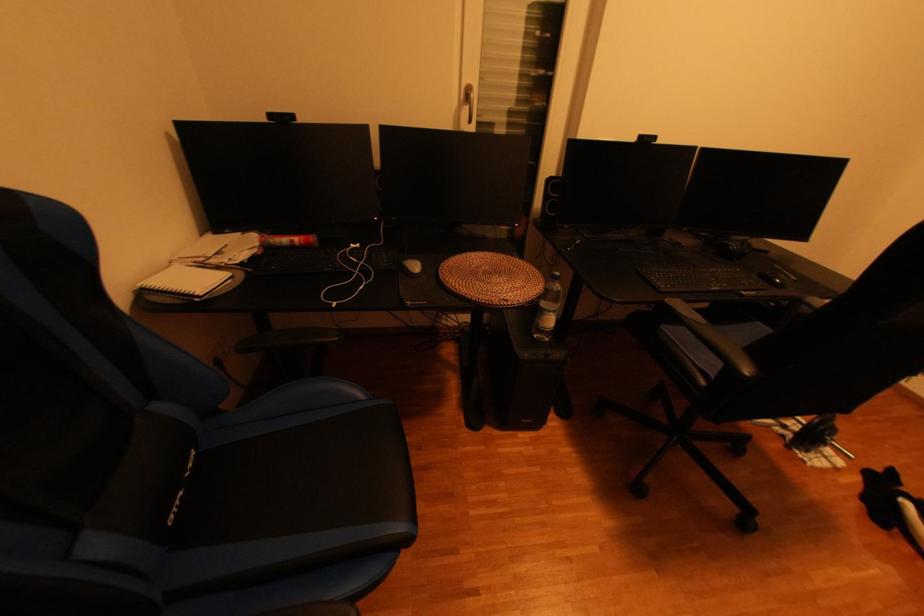
The width and height of the screenshot is (924, 616). Identify the location of white wired earbuds. (353, 270).